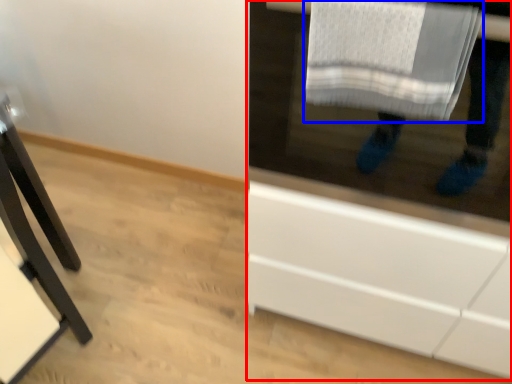
Question: Which object appears farthest to the camera in this image, cabinetry (highlighted by a red box) or bath towel (highlighted by a blue box)?

Choices:
 (A) cabinetry
 (B) bath towel

Answer: (B)